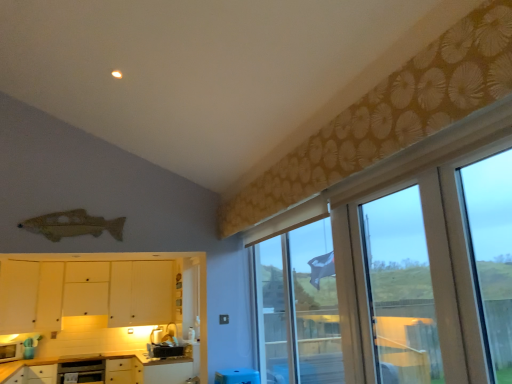
Question: Is white matte cabinet at lower left, which ranks as the 3th cabinetry in top-to-bottom order, located outside white matte cabinet at lower left, which ranks as the third cabinetry in bottom-to-top order?

Choices:
 (A) no
 (B) yes

Answer: (B)

Question: Can you confirm if white matte cabinet at lower left, which ranks as the 3th cabinetry in top-to-bottom order, is thinner than white matte cabinet at lower left, which is counted as the first cabinetry, starting from the top?

Choices:
 (A) yes
 (B) no

Answer: (B)

Question: Is white matte cabinet at lower left, which ranks as the 3th cabinetry in top-to-bottom order, taller than white matte cabinet at lower left, which ranks as the third cabinetry in bottom-to-top order?

Choices:
 (A) yes
 (B) no

Answer: (B)

Question: Is white matte cabinet at lower left, which appears as the first cabinetry when ordered from the bottom, turned away from white matte cabinet at lower left, which ranks as the third cabinetry in bottom-to-top order?

Choices:
 (A) yes
 (B) no

Answer: (B)

Question: Is white matte cabinet at lower left, which appears as the first cabinetry when ordered from the bottom, to the left of white matte cabinet at lower left, which ranks as the third cabinetry in bottom-to-top order, from the viewer's perspective?

Choices:
 (A) no
 (B) yes

Answer: (A)

Question: From the image's perspective, is transparent plastic screen door at right above or below translucent glass window at upper right?

Choices:
 (A) above
 (B) below

Answer: (A)

Question: Which is correct: transparent plastic screen door at right is inside translucent glass window at upper right, or outside of it?

Choices:
 (A) outside
 (B) inside

Answer: (A)

Question: In terms of width, does transparent plastic screen door at right look wider or thinner when compared to translucent glass window at upper right?

Choices:
 (A) thin
 (B) wide

Answer: (A)

Question: From a real-world perspective, relative to translucent glass window at upper right, is transparent plastic screen door at right vertically above or below?

Choices:
 (A) below
 (B) above

Answer: (B)

Question: From the image's perspective, is matte black toaster at lower center, which appears as the 2th appliance when viewed from the left, above or below white matte cabinet at lower left, which ranks as the 3th cabinetry in top-to-bottom order?

Choices:
 (A) above
 (B) below

Answer: (A)

Question: Is matte black toaster at lower center, the first appliance viewed from the right, taller or shorter than white matte cabinet at lower left, which appears as the first cabinetry when ordered from the bottom?

Choices:
 (A) short
 (B) tall

Answer: (A)

Question: From a real-world perspective, is matte black toaster at lower center, which appears as the 2th appliance when viewed from the left, above or below white matte cabinet at lower left, which appears as the first cabinetry when ordered from the bottom?

Choices:
 (A) above
 (B) below

Answer: (A)

Question: Is matte black toaster at lower center, which appears as the 2th appliance when viewed from the left, situated inside white matte cabinet at lower left, which appears as the first cabinetry when ordered from the bottom, or outside?

Choices:
 (A) outside
 (B) inside

Answer: (A)

Question: In terms of height, does transparent plastic screen door at right look taller or shorter compared to white glossy microwave at lower left, the first appliance viewed from the left?

Choices:
 (A) short
 (B) tall

Answer: (B)

Question: Is transparent plastic screen door at right situated inside white glossy microwave at lower left, placed as the second appliance when sorted from right to left, or outside?

Choices:
 (A) inside
 (B) outside

Answer: (B)